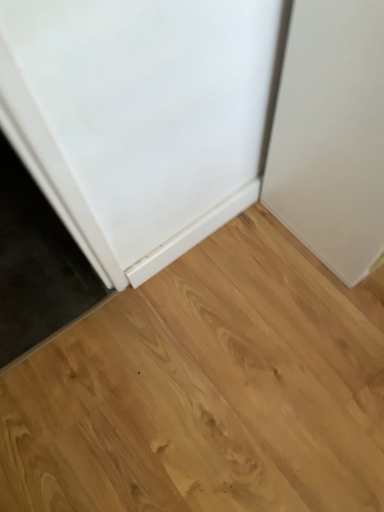
Question: Is natural wood floor at center next to white matte door at upper right and touching it?

Choices:
 (A) yes
 (B) no

Answer: (B)

Question: Are natural wood floor at center and white matte door at upper right far apart?

Choices:
 (A) yes
 (B) no

Answer: (B)

Question: Is natural wood floor at center smaller than white matte door at upper right?

Choices:
 (A) yes
 (B) no

Answer: (A)

Question: Is natural wood floor at center to the right of white matte door at upper right from the viewer's perspective?

Choices:
 (A) yes
 (B) no

Answer: (B)

Question: From a real-world perspective, does natural wood floor at center stand above white matte door at upper right?

Choices:
 (A) yes
 (B) no

Answer: (B)

Question: Is natural wood floor at center wider than white matte door at upper right?

Choices:
 (A) no
 (B) yes

Answer: (B)

Question: Considering the relative positions of white matte door at upper right and natural wood floor at center in the image provided, is white matte door at upper right to the left of natural wood floor at center from the viewer's perspective?

Choices:
 (A) yes
 (B) no

Answer: (B)

Question: Is there a large distance between white matte door at upper right and natural wood floor at center?

Choices:
 (A) yes
 (B) no

Answer: (B)

Question: Considering the relative sizes of white matte door at upper right and natural wood floor at center in the image provided, is white matte door at upper right thinner than natural wood floor at center?

Choices:
 (A) no
 (B) yes

Answer: (B)

Question: Is white matte door at upper right aimed at natural wood floor at center?

Choices:
 (A) no
 (B) yes

Answer: (A)

Question: Would you say white matte door at upper right is outside natural wood floor at center?

Choices:
 (A) no
 (B) yes

Answer: (B)

Question: Is white matte door at upper right closer to the viewer compared to natural wood floor at center?

Choices:
 (A) yes
 (B) no

Answer: (A)

Question: From the image's perspective, relative to natural wood floor at center, is white matte door at upper right above or below?

Choices:
 (A) below
 (B) above

Answer: (B)